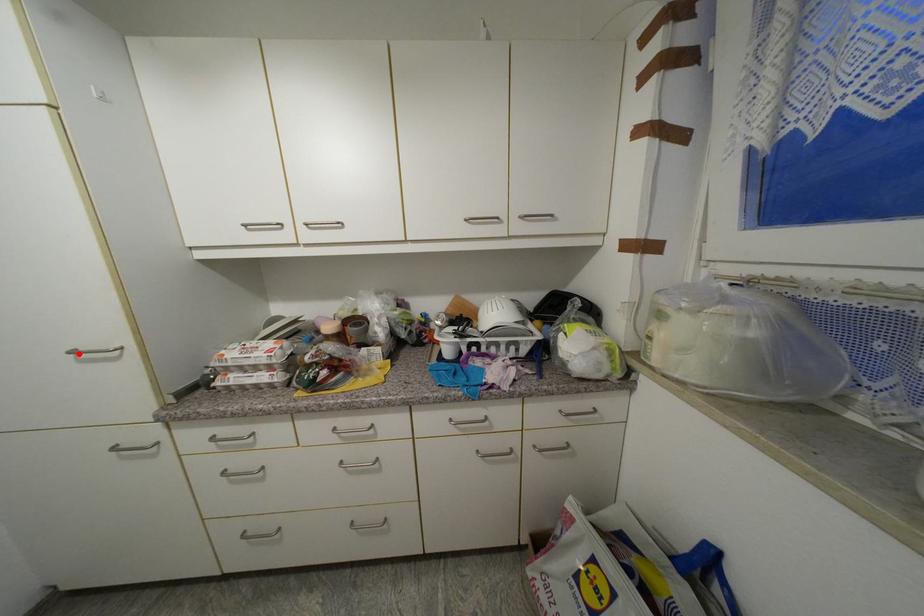
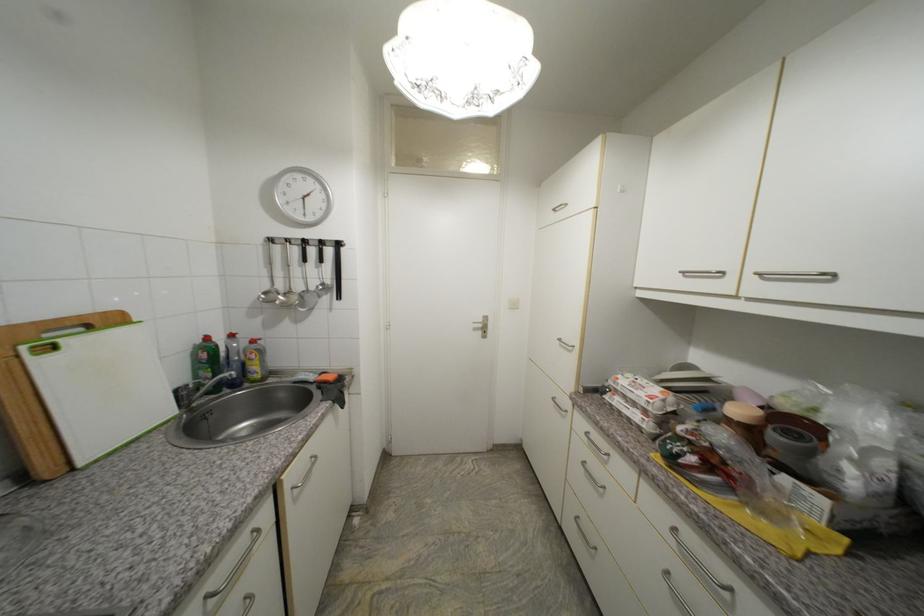
Find the pixel in the second image that matches the highlighted location in the first image.

(565, 341)